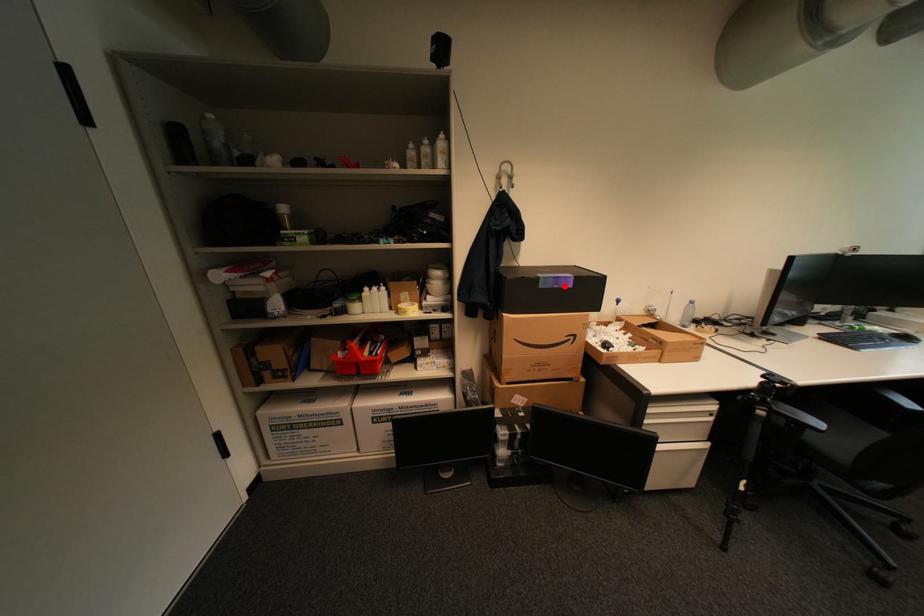
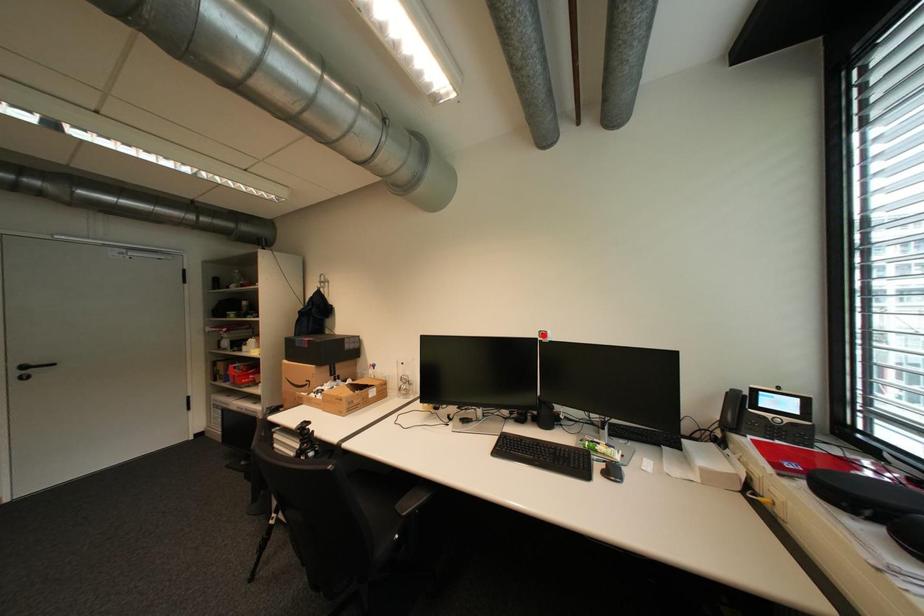
In the scene shown: I am providing you with two images of the same scene from different viewpoints. A red point is marked on the first image and another point is marked on the second image. Is the red point in image1 aligned with the point shown in image2?

No